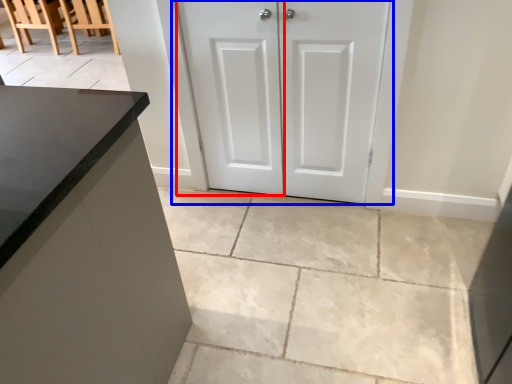
Question: Which point is closer to the camera, screen door (highlighted by a red box) or door (highlighted by a blue box)?

Choices:
 (A) screen door
 (B) door

Answer: (B)